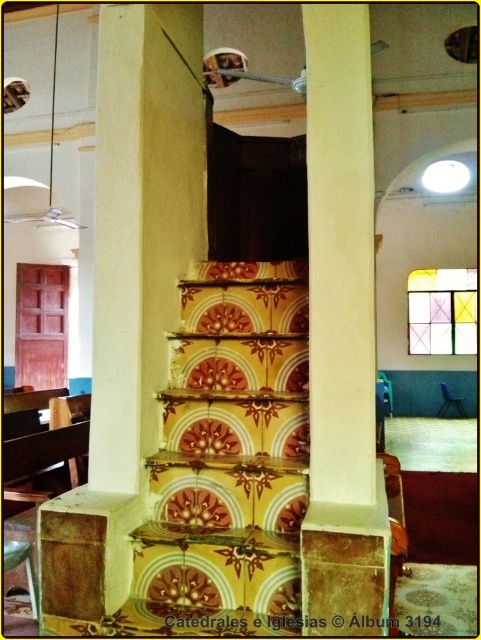
Question: Can you confirm if yellow tile stairs at center is positioned to the right of smooth cream-colored pillar at center?

Choices:
 (A) yes
 (B) no

Answer: (B)

Question: Does yellow tile stairs at center appear over smooth cream-colored pillar at center?

Choices:
 (A) yes
 (B) no

Answer: (B)

Question: Can you confirm if yellow tile stairs at center is wider than smooth cream-colored pillar at center?

Choices:
 (A) yes
 (B) no

Answer: (A)

Question: Which point is closer to the camera?

Choices:
 (A) (247, 513)
 (B) (353, 216)

Answer: (B)